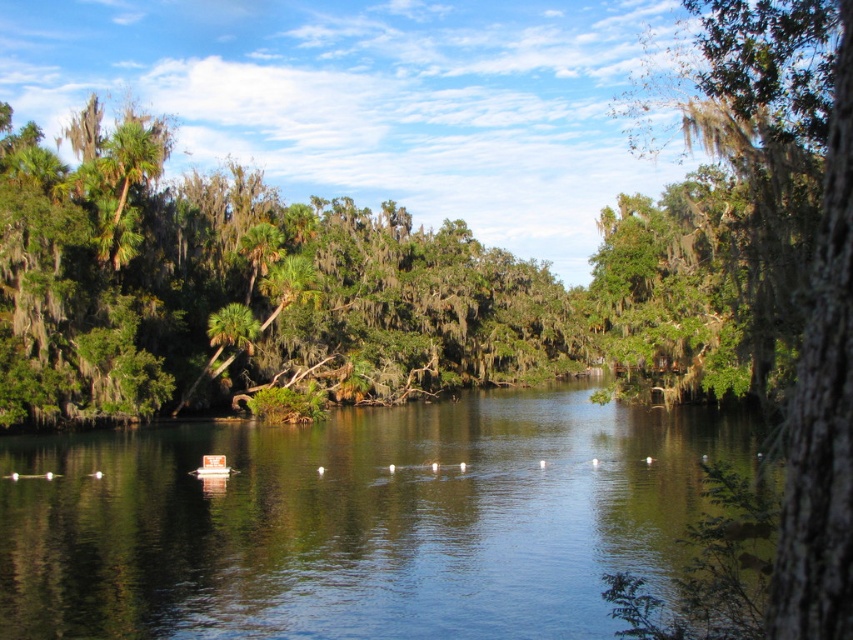
You are standing on the dock and want to know if the green reflective water at center can fit the entire width of the green mossy bark tree at right. Can it?

The green reflective water at center might be wider than green mossy bark tree at right, so it can fit the entire width of the green mossy bark tree at right.

You are standing on the dock and want to throw a lifebuoy to someone in the green reflective water at center. The lifebuoy can travel 10 meters. Is it possible?

The distance between you and the green reflective water at center is 12.20 meters, so the lifebuoy cannot reach them as it can only travel 10 meters.

You are standing at the edge of the water and want to place a buoy exactly where the green reflective water at center is located. According to the coordinates provided, what are the coordinates where you should place the buoy?

The coordinates for the green reflective water at center are 0.814 on the x axis and 0.421 on the y axis, so you should place the buoy at point (358, 520).